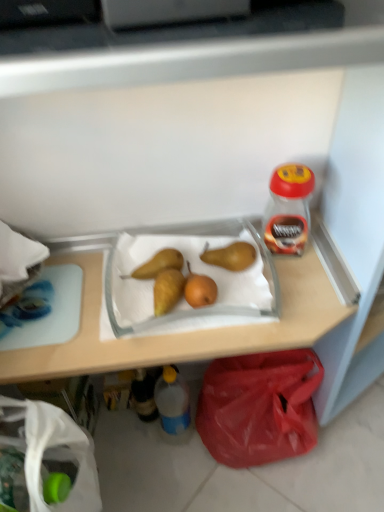
Where is `vacant space in front of brown matte pear at center, marked as the 1th pear in a left-to-right arrangement`? vacant space in front of brown matte pear at center, marked as the 1th pear in a left-to-right arrangement is located at coordinates (142, 316).